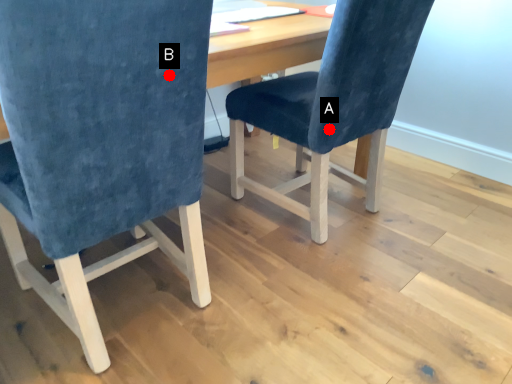
Question: Two points are circled on the image, labeled by A and B beside each circle. Among these points, which one is nearest to the camera?

Choices:
 (A) A is closer
 (B) B is closer

Answer: (B)